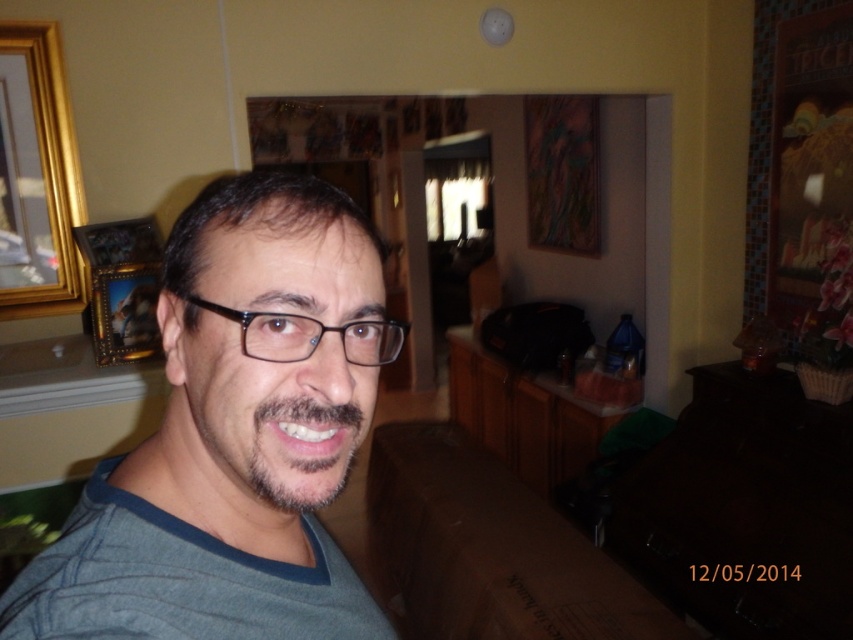
Question: Can you confirm if gray matte shirt at center is thinner than gold wooden picture frame at upper left?

Choices:
 (A) yes
 (B) no

Answer: (B)

Question: Among these objects, which one is farthest from the camera?

Choices:
 (A) gray cotton shirt at center
 (B) gold wooden picture frame at upper left
 (C) gray matte shirt at center

Answer: (B)

Question: Can you confirm if gray matte shirt at center is wider than gold wooden picture frame at upper left?

Choices:
 (A) yes
 (B) no

Answer: (A)

Question: Based on their relative distances, which object is nearer to the graybeard at center?

Choices:
 (A) gray matte shirt at center
 (B) gray cotton shirt at center

Answer: (A)

Question: In this image, where is gray cotton shirt at center located relative to gold metallic picture frame at upper left?

Choices:
 (A) left
 (B) right

Answer: (B)

Question: Which object is positioned farthest from the gold metallic picture frame at upper left?

Choices:
 (A) graybeard at center
 (B) gold wooden picture frame at upper left
 (C) gray matte shirt at center
 (D) gray cotton shirt at center

Answer: (A)